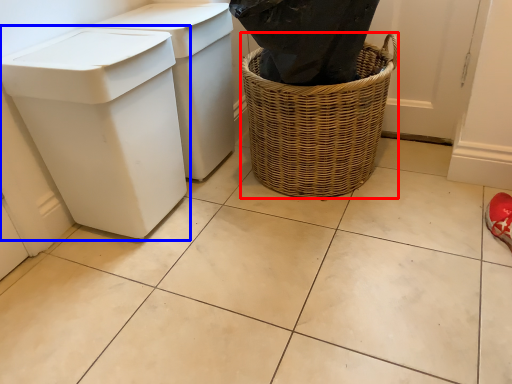
Question: Which object is further to the camera taking this photo, basket container (highlighted by a red box) or waste container (highlighted by a blue box)?

Choices:
 (A) basket container
 (B) waste container

Answer: (A)